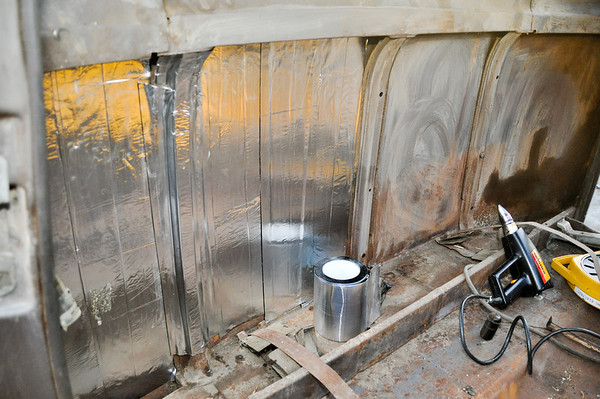
I want to click on handle, so click(513, 288), click(558, 265).